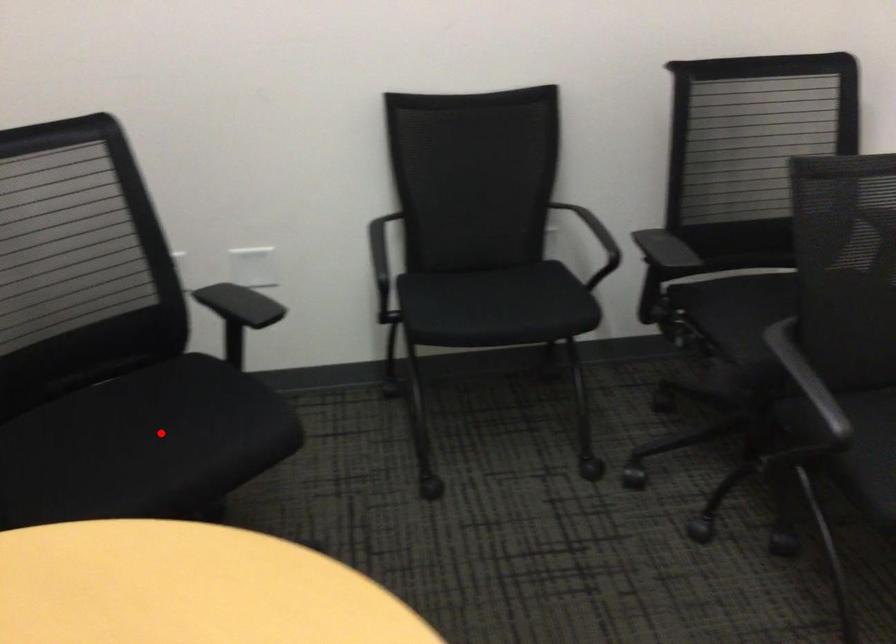
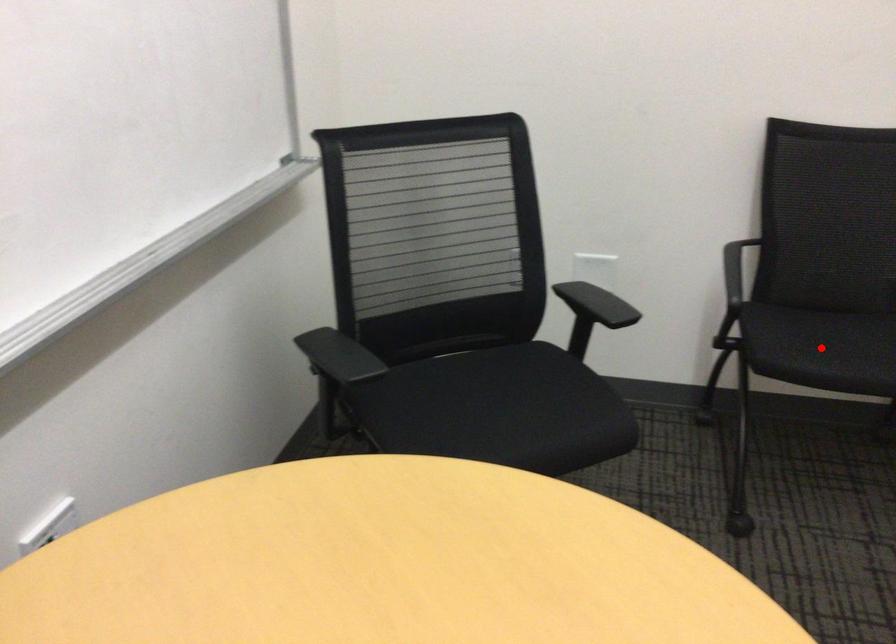
I am providing you with two images of the same scene from different viewpoints. A red point is marked on the first image and another point is marked on the second image. Is the red point in image1 aligned with the point shown in image2?

No